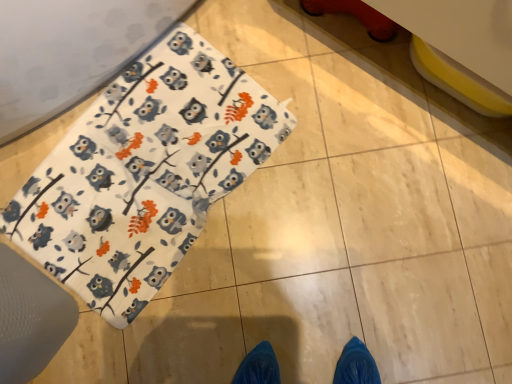
Locate an element on the screen. The height and width of the screenshot is (384, 512). free space above white fabric towel at lower left (from a real-world perspective) is located at coordinates (152, 165).